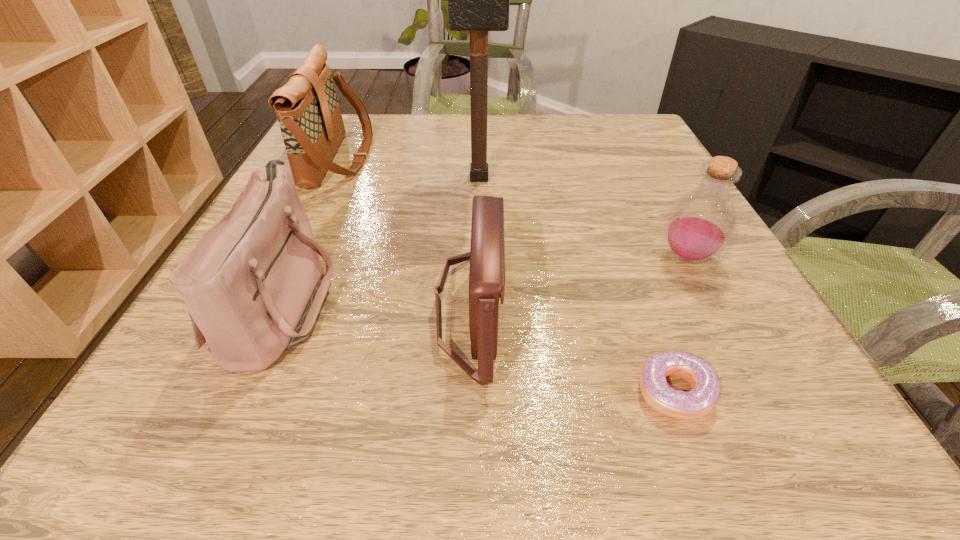
Identify the location of mallet. This screenshot has height=540, width=960. (478, 0).

This screenshot has width=960, height=540. I want to click on the farthest shoulder bag, so click(307, 108).

Find the location of a particular element. bottle is located at coordinates (701, 223).

Locate an element on the screen. The height and width of the screenshot is (540, 960). the second shortest shoulder bag is located at coordinates (254, 284).

The image size is (960, 540). I want to click on the fifth tallest object, so click(x=487, y=251).

Locate an element on the screen. Image resolution: width=960 pixels, height=540 pixels. the rightmost shoulder bag is located at coordinates (487, 251).

Where is `the shortest object`? the shortest object is located at coordinates (698, 402).

The height and width of the screenshot is (540, 960). Identify the location of doughnut. (698, 402).

Identify the location of free region located 0.250m on the front of the tallest object. The width and height of the screenshot is (960, 540). (479, 285).

Locate an element on the screen. free location located 0.260m on the front-facing side of the tallest shoulder bag is located at coordinates (481, 158).